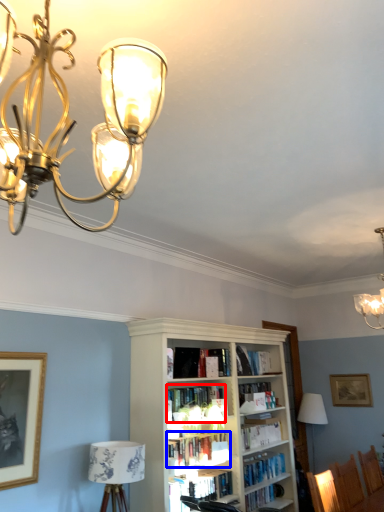
Question: Among these objects, which one is farthest to the camera, book (highlighted by a red box) or book (highlighted by a blue box)?

Choices:
 (A) book
 (B) book

Answer: (A)